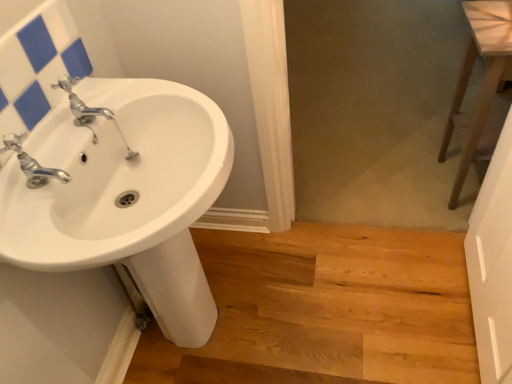
Where is `vacant area that lies between white glossy sink at left and transparent glass screen door at right`? vacant area that lies between white glossy sink at left and transparent glass screen door at right is located at coordinates (355, 306).